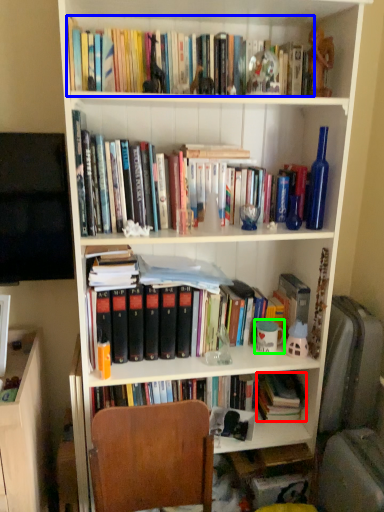
Question: Considering the real-world distances, which object is farthest from book (highlighted by a red box)? book (highlighted by a blue box) or coffee cup (highlighted by a green box)?

Choices:
 (A) book
 (B) coffee cup

Answer: (A)